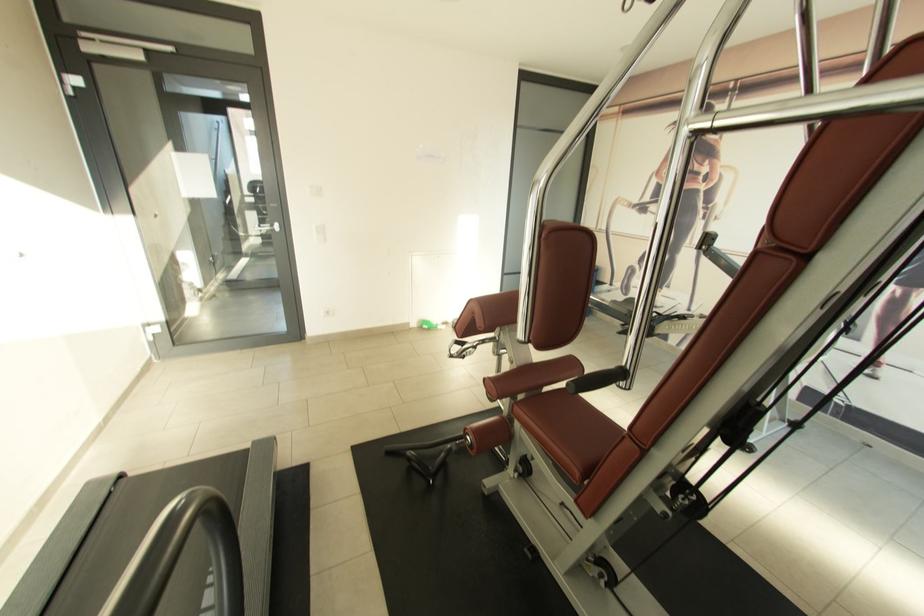
Where would you sit the brown machine seat? Please return your answer as a coordinate pair (x, y).

(567, 430)